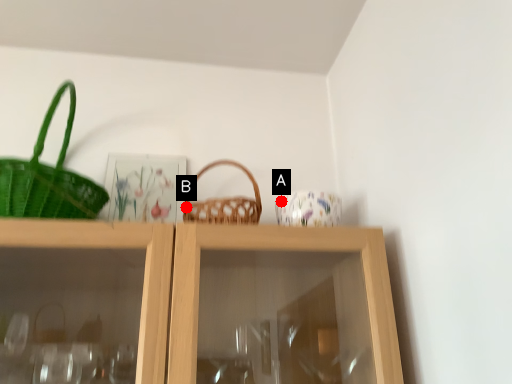
Question: Two points are circled on the image, labeled by A and B beside each circle. Among these points, which one is farthest from the camera?

Choices:
 (A) A is further
 (B) B is further

Answer: (A)